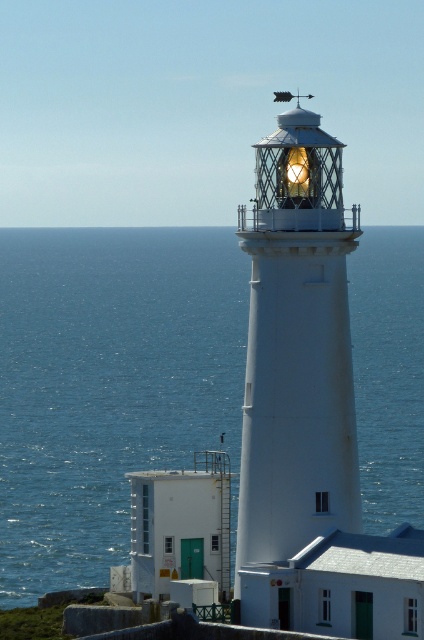
Question: Estimate the real-world distances between objects in this image. Which object is farther from the white textured lighthouse at center?

Choices:
 (A) blue water at center
 (B) matte glass lighthouse at center

Answer: (A)

Question: Which point is closer to the camera?

Choices:
 (A) matte glass lighthouse at center
 (B) white textured lighthouse at center

Answer: (B)

Question: Is white textured lighthouse at center thinner than matte glass lighthouse at center?

Choices:
 (A) yes
 (B) no

Answer: (B)

Question: Does white textured lighthouse at center have a larger size compared to matte glass lighthouse at center?

Choices:
 (A) yes
 (B) no

Answer: (A)

Question: Can you confirm if blue water at center is positioned below white textured lighthouse at center?

Choices:
 (A) no
 (B) yes

Answer: (A)

Question: Which object appears farthest from the camera in this image?

Choices:
 (A) blue water at center
 (B) white textured lighthouse at center

Answer: (A)